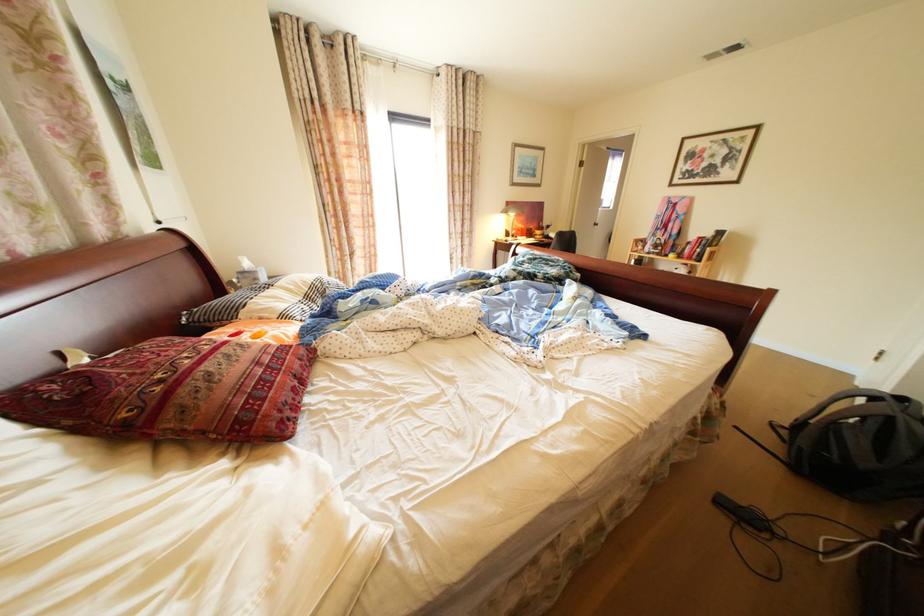
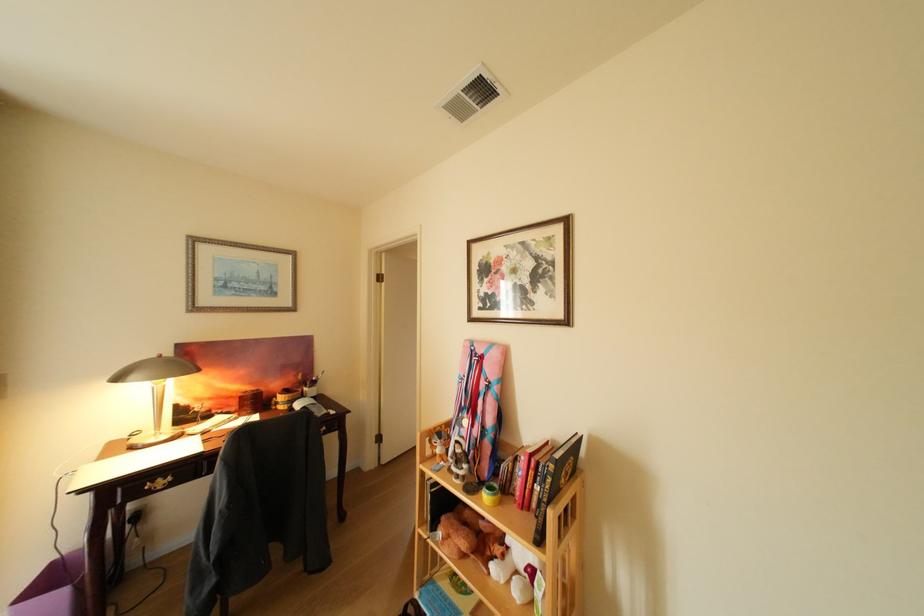
In the second image, find the point that corresponds to point (711, 249) in the first image.

(548, 484)